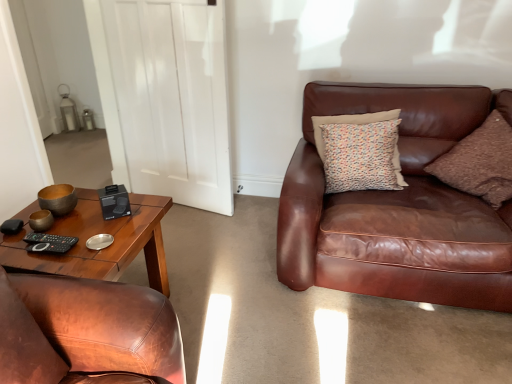
Locate an element on the screen. blank space to the left of brown leather couch at right is located at coordinates (238, 279).